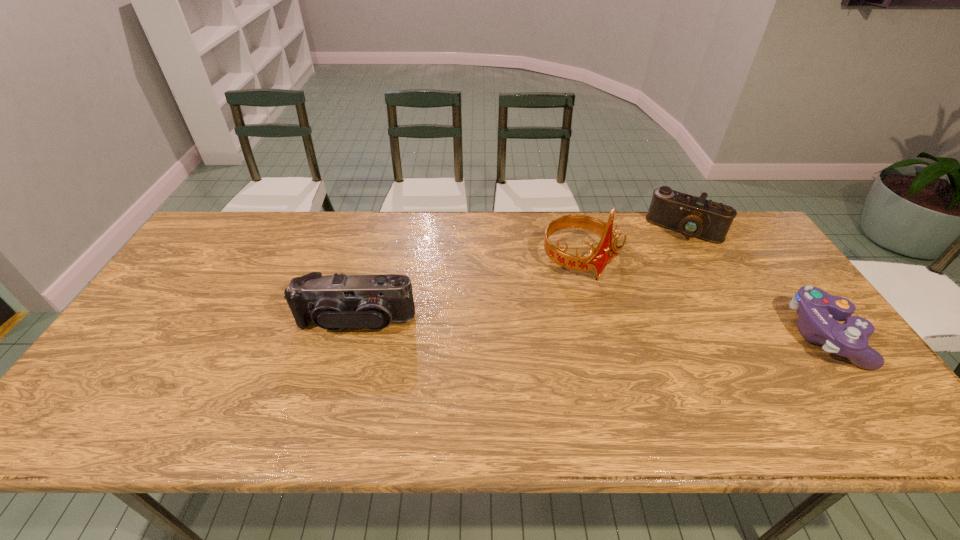
Identify the location of free area in between the control and the camera. (754, 282).

Image resolution: width=960 pixels, height=540 pixels. I want to click on free space between the third tallest object and the tallest object, so click(x=632, y=245).

This screenshot has height=540, width=960. What are the coordinates of `vacant area that lies between the second shortest object and the tallest object` in the screenshot? It's located at (632, 245).

Find the location of a particular element. The height and width of the screenshot is (540, 960). free space between the third object from left to right and the tiara is located at coordinates (632, 245).

I want to click on vacant region between the third object from right to left and the camcorder, so click(x=468, y=291).

Where is `vacant area that lies between the third shortest object and the tallest object`? The height and width of the screenshot is (540, 960). vacant area that lies between the third shortest object and the tallest object is located at coordinates (468, 291).

I want to click on free space between the rightmost object and the third object from right to left, so click(x=701, y=298).

The width and height of the screenshot is (960, 540). I want to click on free space between the third tallest object and the tiara, so click(x=632, y=245).

Where is `free space between the third object from right to left and the camera`? free space between the third object from right to left and the camera is located at coordinates (632, 245).

Where is `object that stands as the closest to the rightmost object`? Image resolution: width=960 pixels, height=540 pixels. object that stands as the closest to the rightmost object is located at coordinates (694, 217).